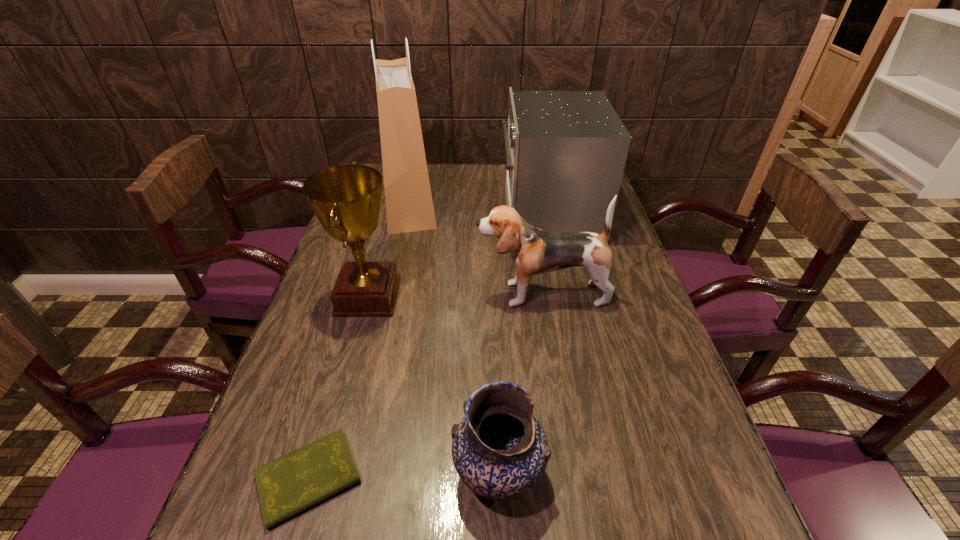
Identify the location of diary at the left edge. This screenshot has width=960, height=540. (288, 485).

In order to click on toaster oven that is positioned at the right edge in this screenshot , I will do pyautogui.click(x=565, y=151).

Locate an element on the screen. puppy that is at the right edge is located at coordinates (533, 251).

Where is `object that is positioned at the far left corner`? object that is positioned at the far left corner is located at coordinates (409, 207).

Identify the location of object located in the far right corner section of the desktop. The height and width of the screenshot is (540, 960). (565, 151).

Locate an element on the screen. vacant space at the far edge of the desktop is located at coordinates (446, 172).

In the image, there is a desktop. Where is `vacant space at the left edge`? Image resolution: width=960 pixels, height=540 pixels. vacant space at the left edge is located at coordinates (294, 381).

In the image, there is a desktop. In order to click on vacant space at the right edge in this screenshot , I will do `click(676, 393)`.

Identify the location of vacant space in between the second shortest object and the shortest object. The image size is (960, 540). (404, 477).

Identify the location of empty space that is in between the pottery and the shopping bag. This screenshot has width=960, height=540. (453, 339).